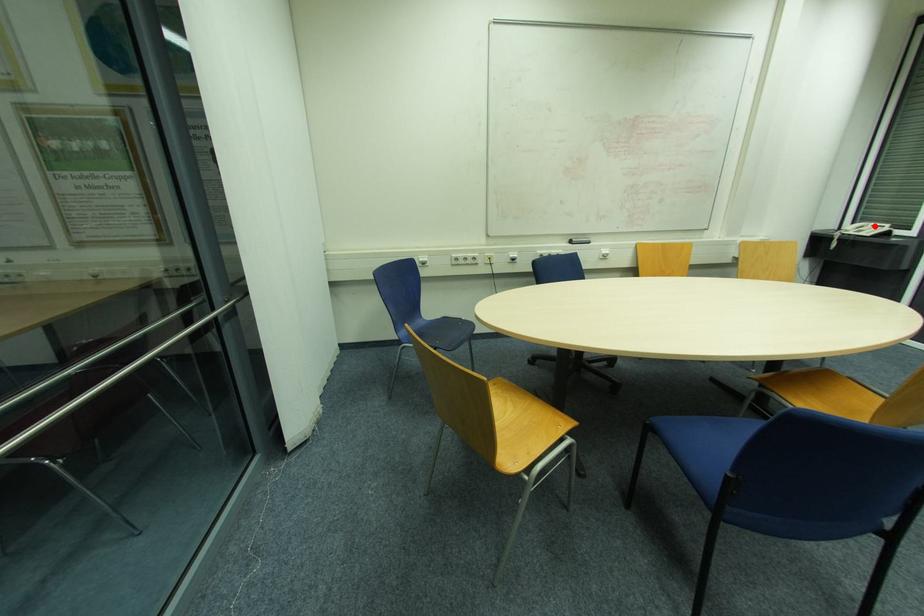
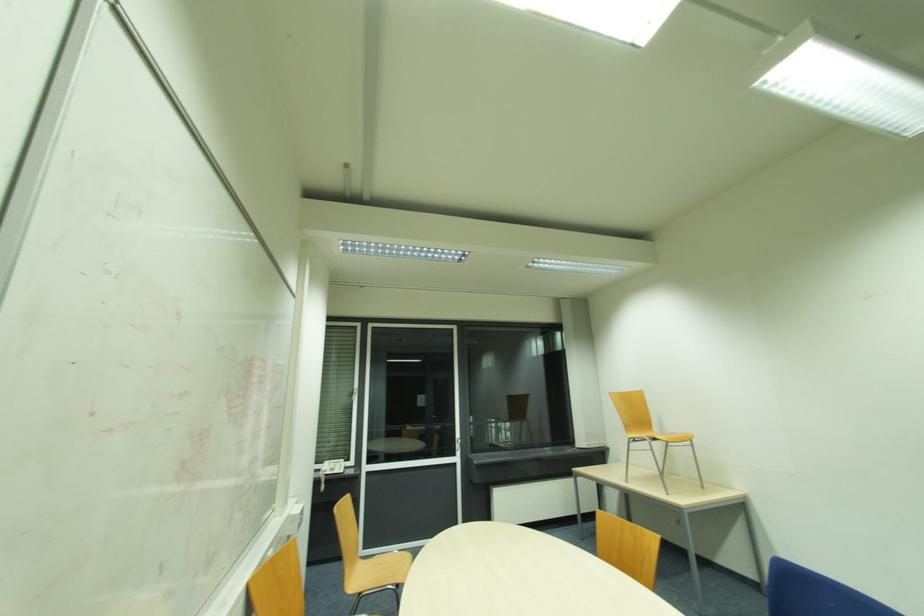
Question: I am providing you with two images of the same scene from different viewpoints. In image1, a red point is highlighted. Considering the same 3D point in image2, which of the following is correct?

Choices:
 (A) It is closer
 (B) It is farther

Answer: (B)